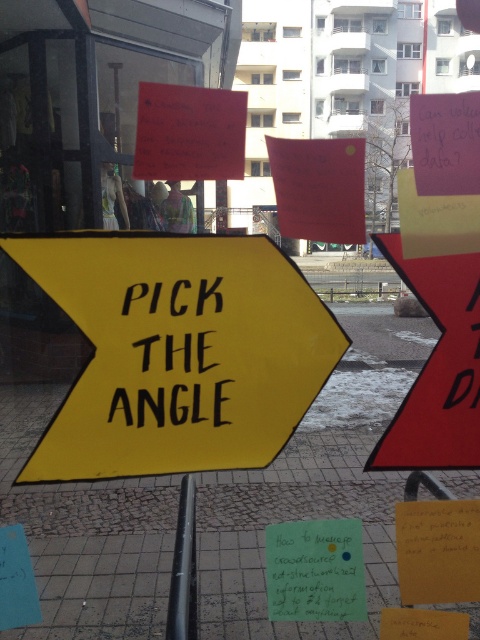
You are a customer looking at the window display and want to read both the green paper sign at center and the black matte text at center. Which one will you notice first?

The green paper sign at center is bigger than the black matte text at center, so you will notice the green paper sign at center first because it is larger and more prominent.

You are standing in front of the window display and notice two points labeled point (167,348) and point (171,627). Which point is closer to you?

Point (167,348) is closer to the viewer than point (171,627).